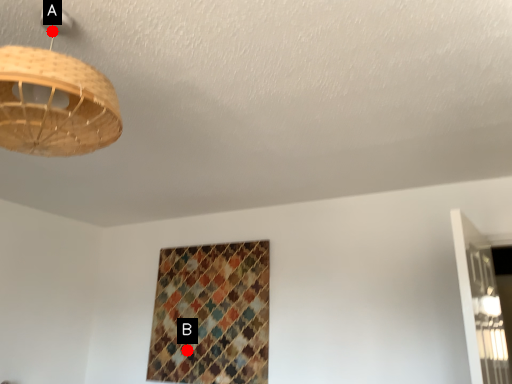
Question: Two points are circled on the image, labeled by A and B beside each circle. Which point is further to the camera?

Choices:
 (A) A is further
 (B) B is further

Answer: (B)